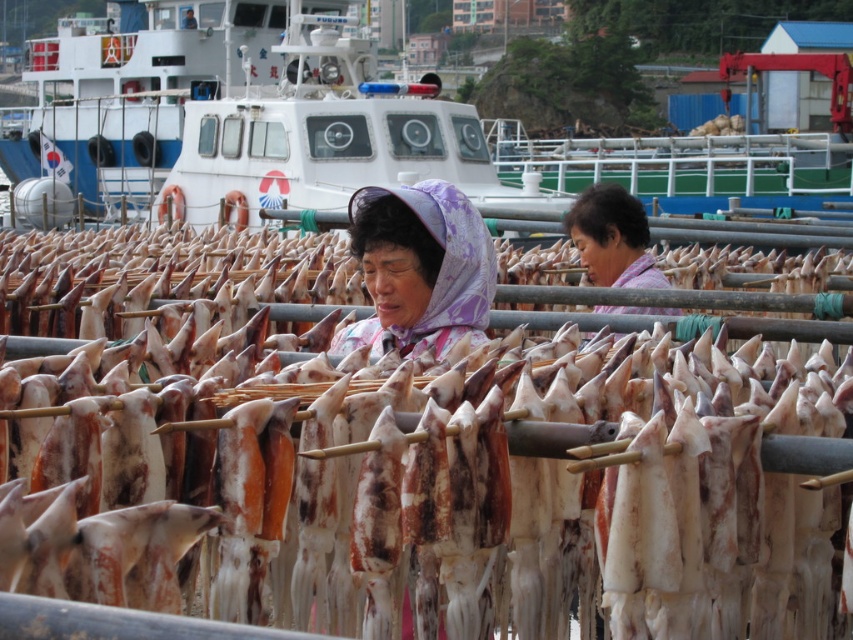
Question: Which point is farther from the camera taking this photo?

Choices:
 (A) (326, 134)
 (B) (276, 74)
 (C) (432, 218)

Answer: (B)

Question: Can you confirm if white glossy boat at upper center is wider than purple floral headscarf at center?

Choices:
 (A) no
 (B) yes

Answer: (B)

Question: Which point appears farthest from the camera in this image?

Choices:
 (A) [x=112, y=56]
 (B) [x=258, y=99]
 (C) [x=445, y=198]

Answer: (A)

Question: Does white plastic boat at upper center appear under purple floral headscarf at center?

Choices:
 (A) yes
 (B) no

Answer: (B)

Question: Can you confirm if white glossy boat at upper center is bigger than purple floral headscarf at center?

Choices:
 (A) no
 (B) yes

Answer: (B)

Question: Which of the following is the farthest from the observer?

Choices:
 (A) purple floral headscarf at center
 (B) white glossy boat at upper center

Answer: (B)